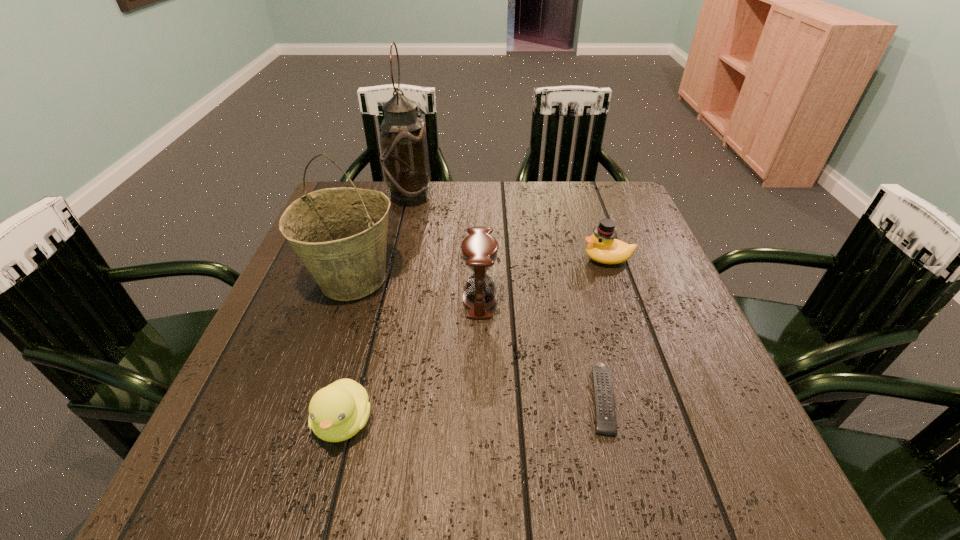
The height and width of the screenshot is (540, 960). In order to click on empty space that is in between the oil lamp and the third object from right to left in this screenshot , I will do `click(444, 248)`.

In order to click on empty space that is in between the oil lamp and the fourth object from left to right in this screenshot , I will do `click(444, 248)`.

The height and width of the screenshot is (540, 960). I want to click on free space between the wine bucket and the remote control, so click(477, 339).

The height and width of the screenshot is (540, 960). Identify the location of vacant area that lies between the second object from right to left and the hourglass. (540, 349).

In order to click on blank region between the hourglass and the duckling in this screenshot , I will do `click(412, 360)`.

Identify which object is the fifth nearest to the third object from right to left. Please provide its 2D coordinates. Your answer should be formatted as a tuple, i.e. [(x, y)], where the tuple contains the x and y coordinates of a point satisfying the conditions above.

[(404, 157)]

The image size is (960, 540). Identify the location of object that is the third closest one to the third object from right to left. (603, 247).

Locate an element on the screen. Image resolution: width=960 pixels, height=540 pixels. vacant space that satisfies the following two spatial constraints: 1. on the back side of the farthest object; 2. on the right side of the wine bucket is located at coordinates (379, 197).

Find the location of a particular element. The width and height of the screenshot is (960, 540). vacant space that satisfies the following two spatial constraints: 1. on the front-facing side of the duck; 2. at the beak of the duckling is located at coordinates (665, 422).

At what (x,y) coordinates should I click in order to perform the action: click on free spot that satisfies the following two spatial constraints: 1. on the back side of the second tallest object; 2. on the left side of the tallest object. Please return your answer as a coordinate pair (x, y). The width and height of the screenshot is (960, 540). Looking at the image, I should click on (379, 197).